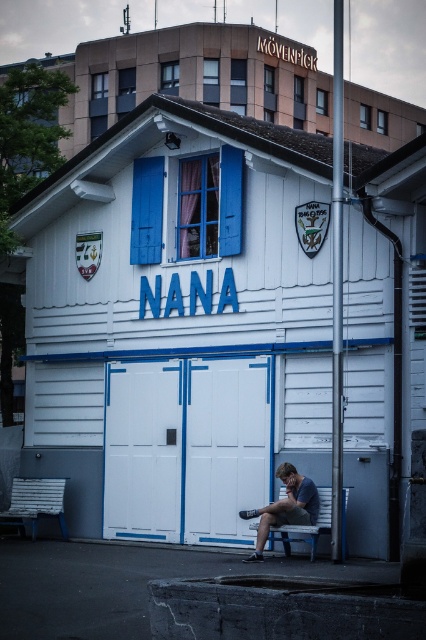
You are standing in front of the building labeled NANA. You need to locate both the white painted wood garage door at center and the blue wooden bench at lower center. Which one is positioned to the left of the other?

The white painted wood garage door at center is to the left of the blue wooden bench at lower center.

You are standing in front of the white wooden building labeled NANA. There are two points marked on the structure. The first point is at coordinates point (161, 458) and the second is at point (311, 525). Which of these points is closer to your eyes?

Point (161, 458) is further to the camera than point (311, 525), so the point closer to your eyes is point (161, 458).